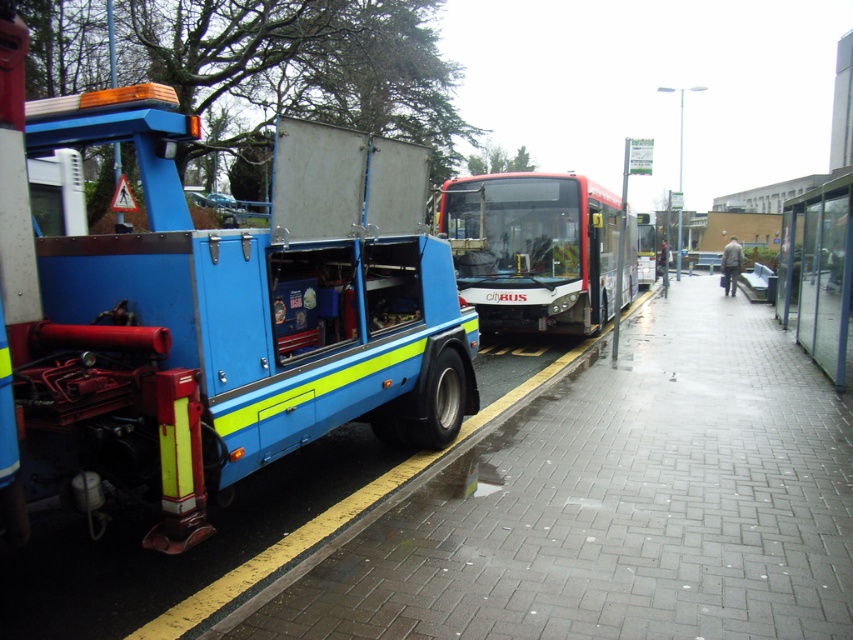
You are a pedestrian standing at the edge of the brick paved sidewalk at lower left and want to cross to the white glossy bus at center. Which direction should you walk to get closer to the bus?

The brick paved sidewalk at lower left is closer to the viewer than the white glossy bus at center. To reach the bus, you should walk towards the center of the scene where the white glossy bus is located.

In the scene shown: You are standing at the center of the image and want to walk to the brick paved sidewalk at lower left. Which direction should you move in to reach it?

The brick paved sidewalk at lower left is located at point (616, 502), so you should move towards the lower left direction to reach it.